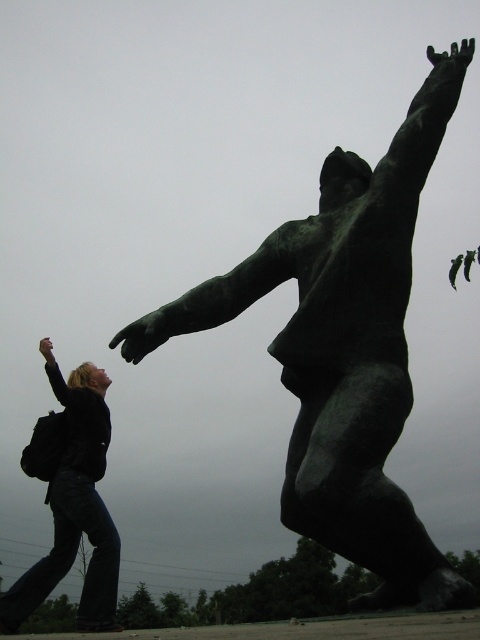
Between point (344, 451) and point (52, 548), which one is positioned behind?

The point (52, 548) is behind.

Can you confirm if green patina bronze statue at center is taller than dark blue jeans at lower left?

Yes.

Who is more forward, (450, 116) or (97, 532)?

Positioned in front is point (450, 116).

At what (x,y) coordinates should I click in order to perform the action: click on green patina bronze statue at center. Please return your answer as a coordinate pair (x, y). Image resolution: width=480 pixels, height=640 pixels. Looking at the image, I should click on (346, 349).